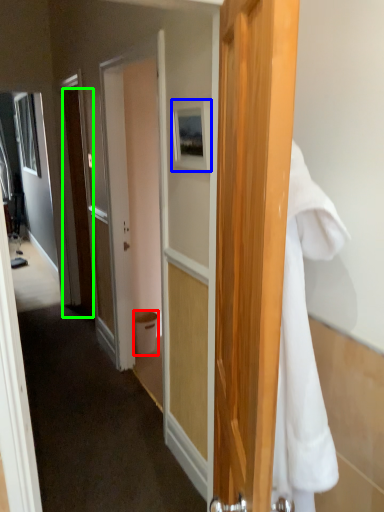
Question: Based on their relative distances, which object is farther from trash bin/can (highlighted by a red box)? Choose from picture frame (highlighted by a blue box) and door (highlighted by a green box).

Choices:
 (A) picture frame
 (B) door

Answer: (A)